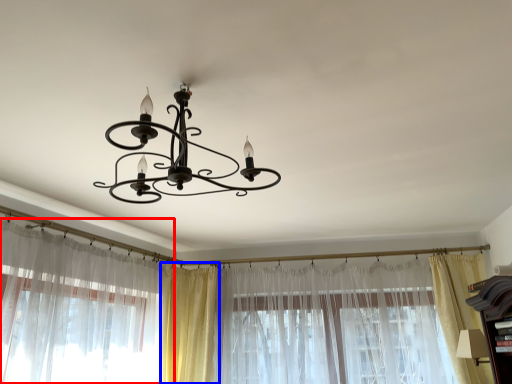
Question: Which of the following is the farthest to the observer, curtain (highlighted by a red box) or curtain (highlighted by a blue box)?

Choices:
 (A) curtain
 (B) curtain

Answer: (B)